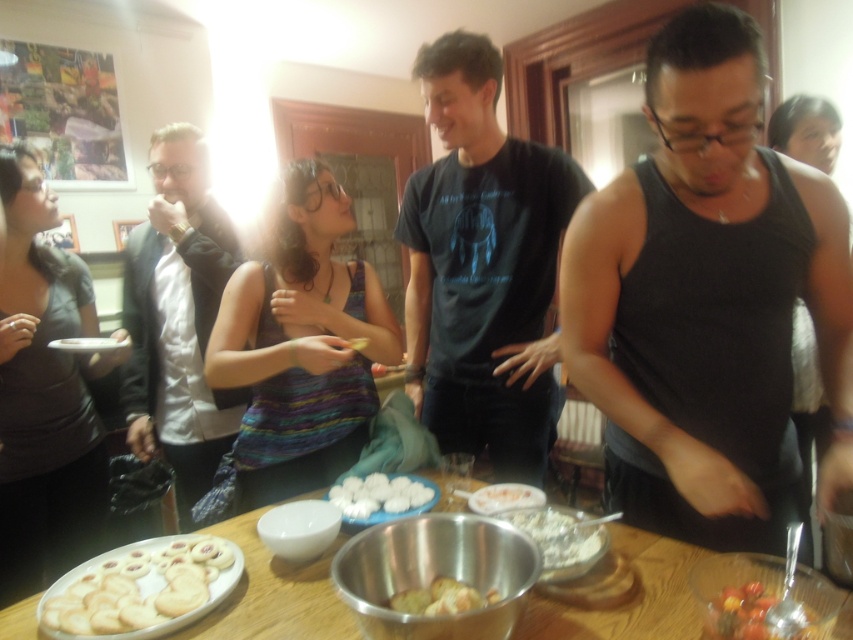
Is translucent glass bowl at lower right positioned before white fluffy marshmallows at center?

Yes, translucent glass bowl at lower right is in front of white fluffy marshmallows at center.

Is point (741, 604) farther from camera compared to point (519, 493)?

No, it is in front of (519, 493).

Locate an element on the screen. The width and height of the screenshot is (853, 640). translucent glass bowl at lower right is located at coordinates (758, 614).

Measure the distance between point [428,220] and camera.

A distance of 1.92 meters exists between point [428,220] and camera.

Between black cotton t-shirt at center and white fluffy marshmallows at center, which one appears on the right side from the viewer's perspective?

From the viewer's perspective, white fluffy marshmallows at center appears more on the right side.

Between point (526, 436) and point (518, 493), which one is positioned in front?

Point (518, 493)

Find the location of a particular element. black cotton t-shirt at center is located at coordinates [483, 266].

Does white powdery flour at center lie in front of white matte dumplings at center?

Yes, white powdery flour at center is in front of white matte dumplings at center.

Describe the element at coordinates (560, 534) in the screenshot. I see `white powdery flour at center` at that location.

Locate an element on the screen. The width and height of the screenshot is (853, 640). white powdery flour at center is located at coordinates (560, 534).